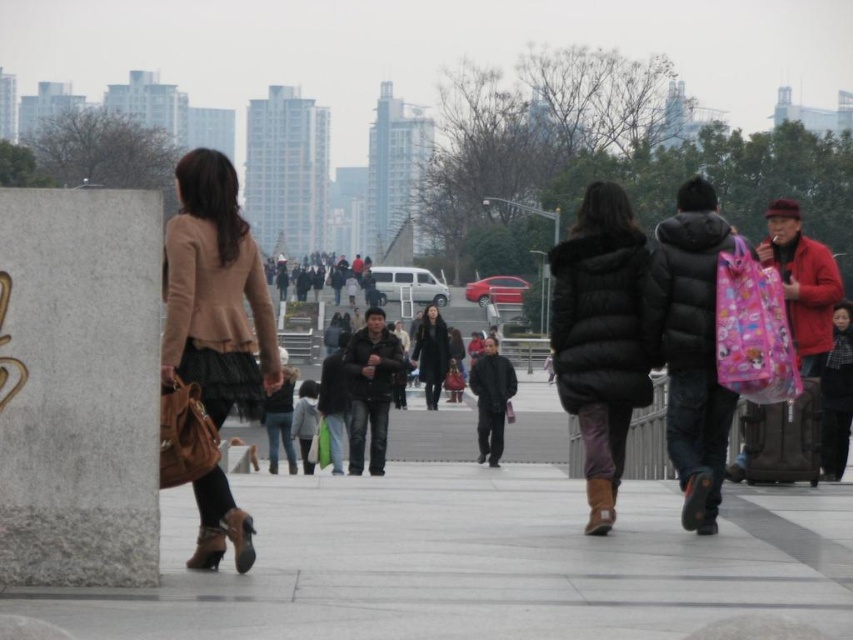
You are standing at the point marked as point (477, 563) in the image. What material are you standing on?

You are standing on gray concrete pavement at center.

You are a pedestrian standing on the gray concrete pavement at center and want to move to the matte beige coat at left. Which direction should you walk to reach it?

The gray concrete pavement at center is positioned on the right side of matte beige coat at left, so you should walk to the left to reach the matte beige coat at left.